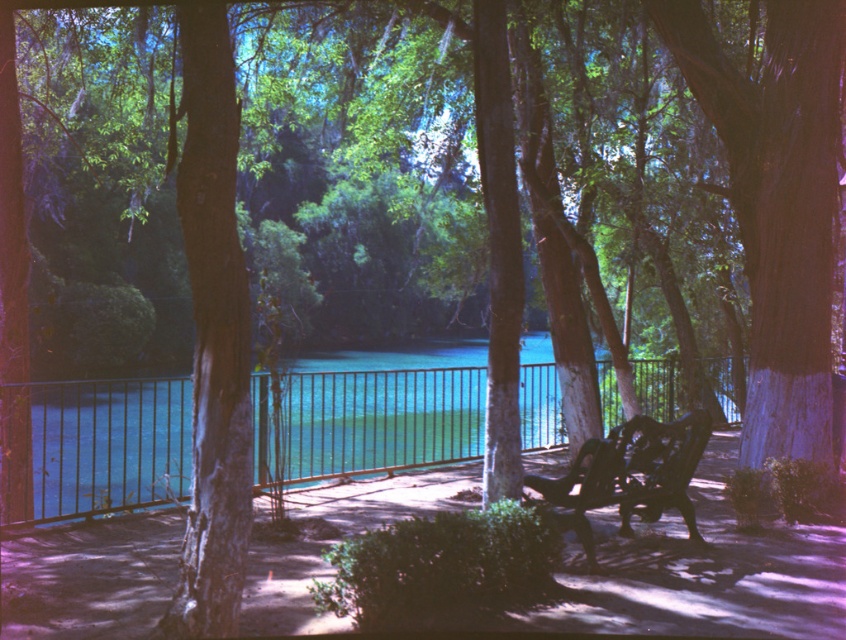
Question: Is teal glass water at center thinner than dark brown wood bench at center?

Choices:
 (A) no
 (B) yes

Answer: (A)

Question: In this image, where is teal glass water at center located relative to dark brown wood bench at center?

Choices:
 (A) below
 (B) above

Answer: (B)

Question: Is teal glass water at center smaller than dark brown wood bench at center?

Choices:
 (A) no
 (B) yes

Answer: (A)

Question: Which of the following is the farthest from the observer?

Choices:
 (A) teal glass water at center
 (B) dark brown wood bench at center

Answer: (B)

Question: Among these points, which one is nearest to the camera?

Choices:
 (A) (399, 356)
 (B) (669, 452)

Answer: (B)

Question: Which point is farther to the camera?

Choices:
 (A) dark brown wood bench at center
 (B) teal glass water at center

Answer: (A)